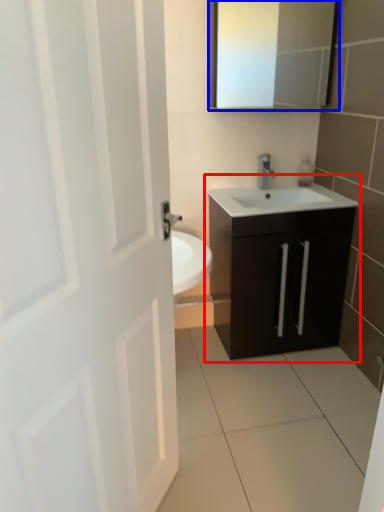
Question: Which object appears farthest to the camera in this image, bathroom cabinet (highlighted by a red box) or medicine cabinet (highlighted by a blue box)?

Choices:
 (A) bathroom cabinet
 (B) medicine cabinet

Answer: (B)